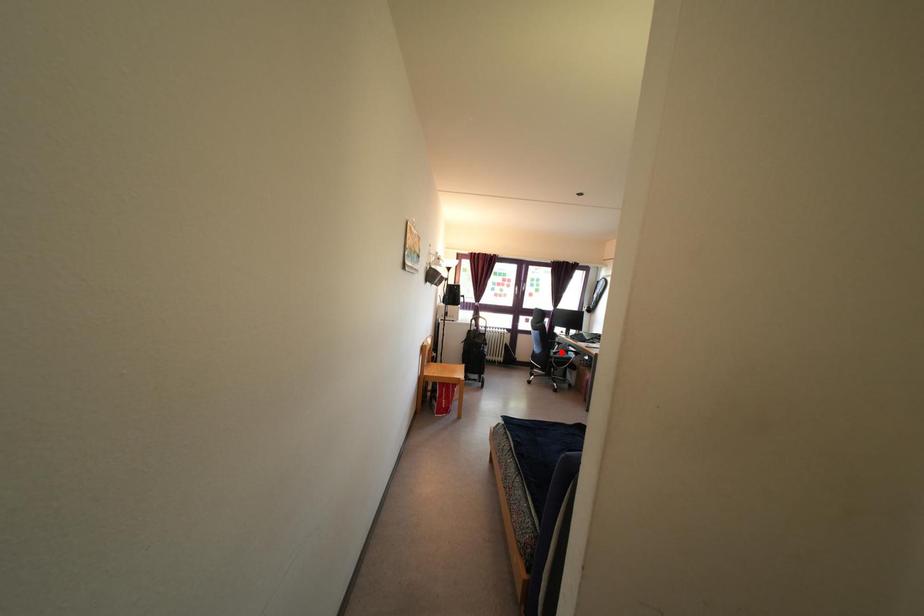
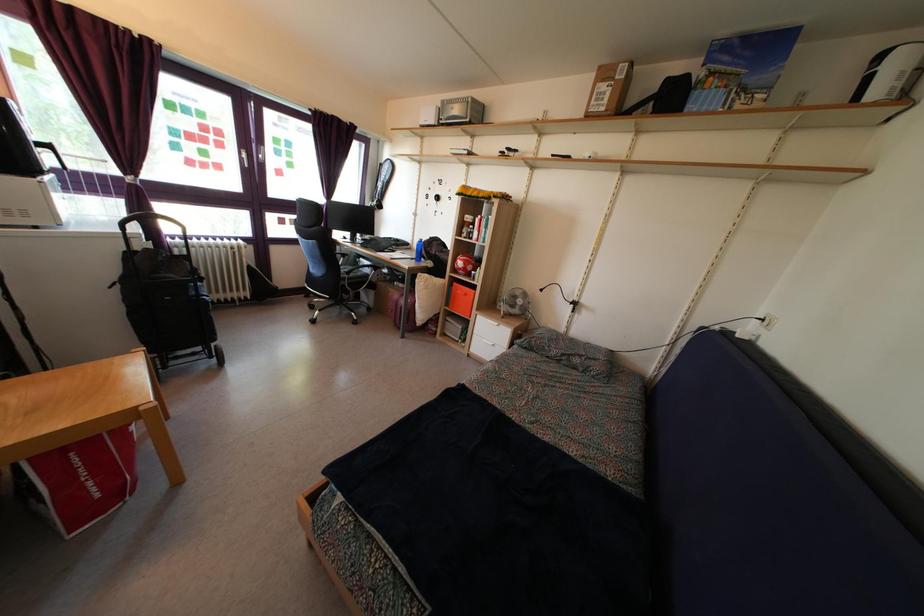
Question: I am providing you with two images of the same scene from different viewpoints. Image1 has a red point marked. In image2, the corresponding 3D location appears at what relative position? Reply with the corresponding letter.

Choices:
 (A) Closer
 (B) Farther

Answer: (A)